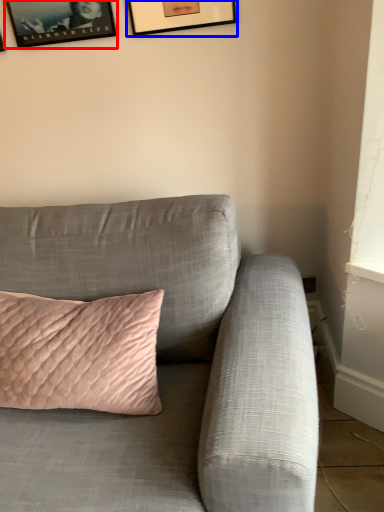
Question: Which object appears closest to the camera in this image, picture frame (highlighted by a red box) or picture frame (highlighted by a blue box)?

Choices:
 (A) picture frame
 (B) picture frame

Answer: (B)